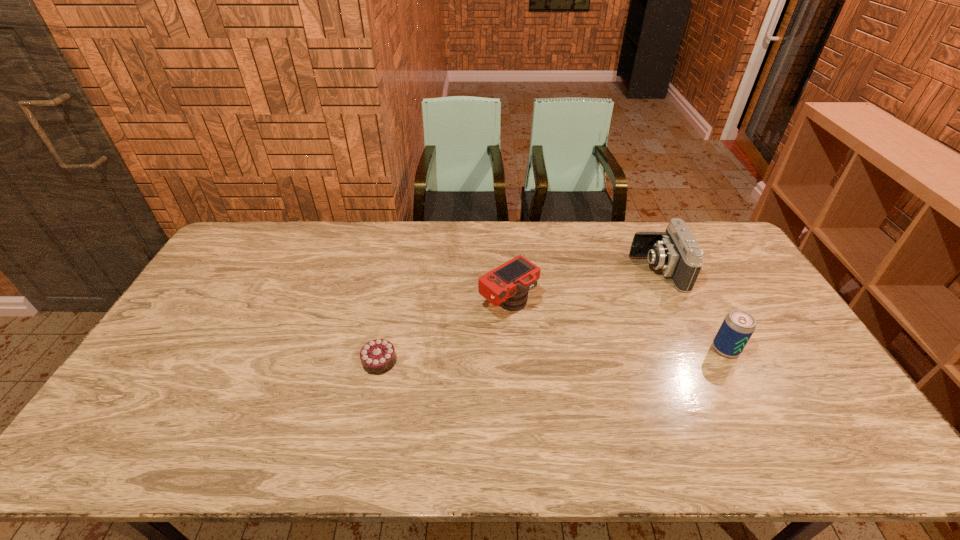
In order to click on free region that satisfies the following two spatial constraints: 1. at the front of the right camera with an open lens cover; 2. on the right side of the beer can in this screenshot , I will do `click(693, 349)`.

I want to click on vacant space that satisfies the following two spatial constraints: 1. at the front of the right camera with an open lens cover; 2. on the left side of the beer can, so click(x=693, y=349).

Identify the location of free space that satisfies the following two spatial constraints: 1. on the back side of the beer can; 2. on the right side of the chocolate cake. The image size is (960, 540). (382, 349).